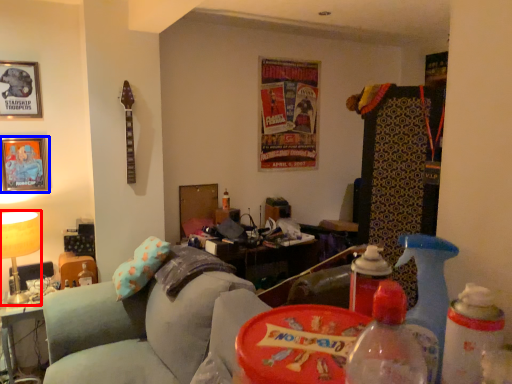
Question: Which of the following is the farthest to the observer, table lamp (highlighted by a red box) or picture frame (highlighted by a blue box)?

Choices:
 (A) table lamp
 (B) picture frame

Answer: (B)